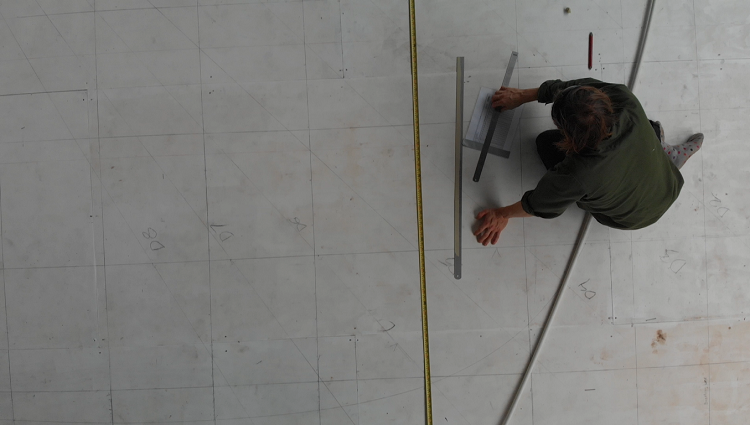
Locate an element on the screen. pen is located at coordinates (592, 43).